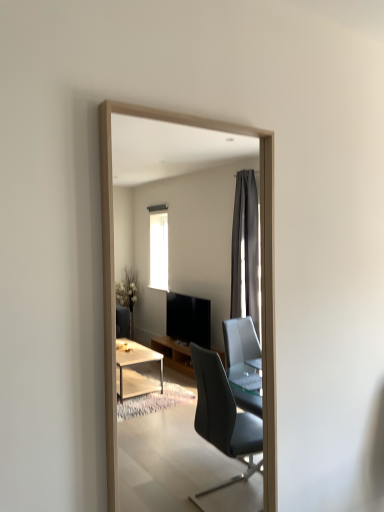
Locate an element on the screen. free space above light wood frame mirror at center (from a real-world perspective) is located at coordinates coord(192,117).